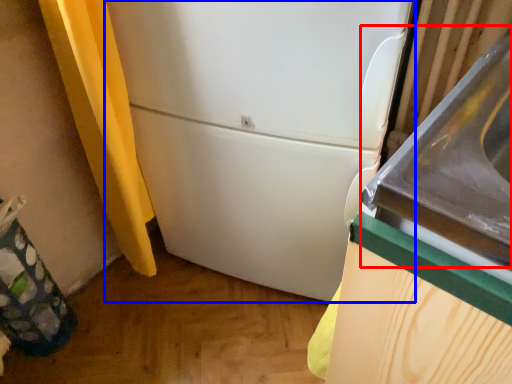
Question: Among these objects, which one is nearest to the camera, sink (highlighted by a red box) or refrigerator (highlighted by a blue box)?

Choices:
 (A) sink
 (B) refrigerator

Answer: (A)